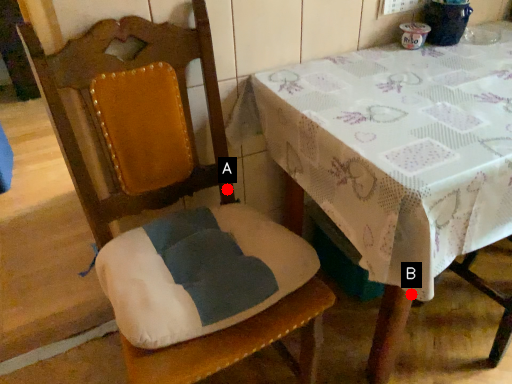
Question: Two points are circled on the image, labeled by A and B beside each circle. Which point is further to the camera?

Choices:
 (A) A is further
 (B) B is further

Answer: (A)